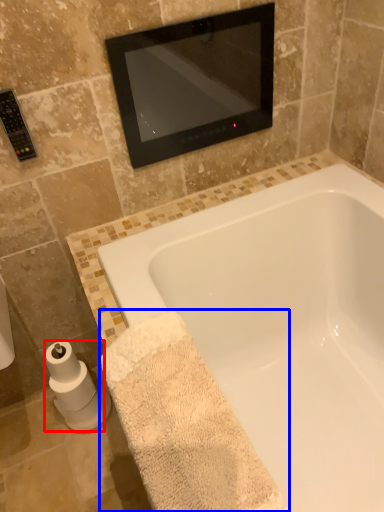
Question: Which object appears closest to the camera in this image, toilet paper (highlighted by a red box) or bath towel (highlighted by a blue box)?

Choices:
 (A) toilet paper
 (B) bath towel

Answer: (B)